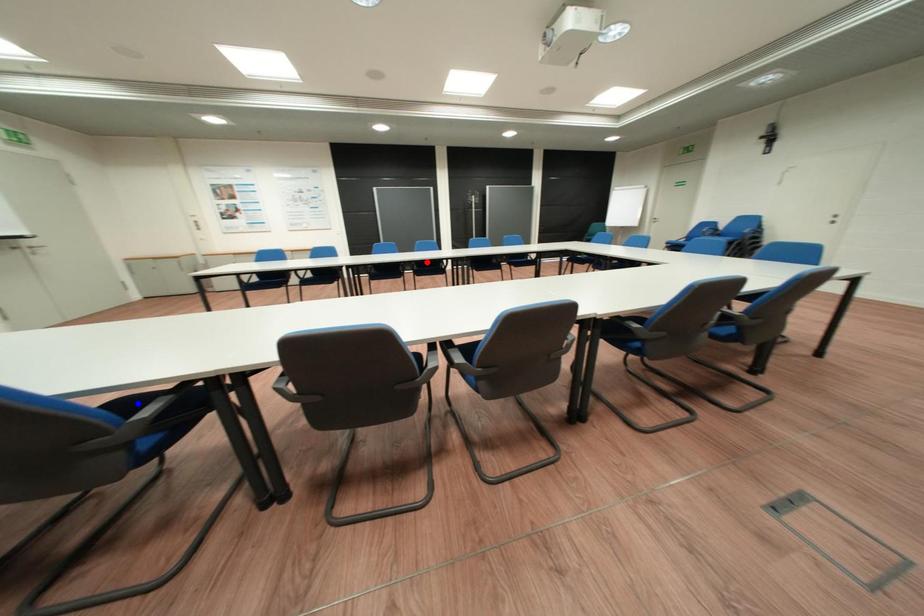
Question: Two points are marked on the image. Which point is closer to the camera?

Choices:
 (A) Blue point is closer.
 (B) Red point is closer.

Answer: (A)